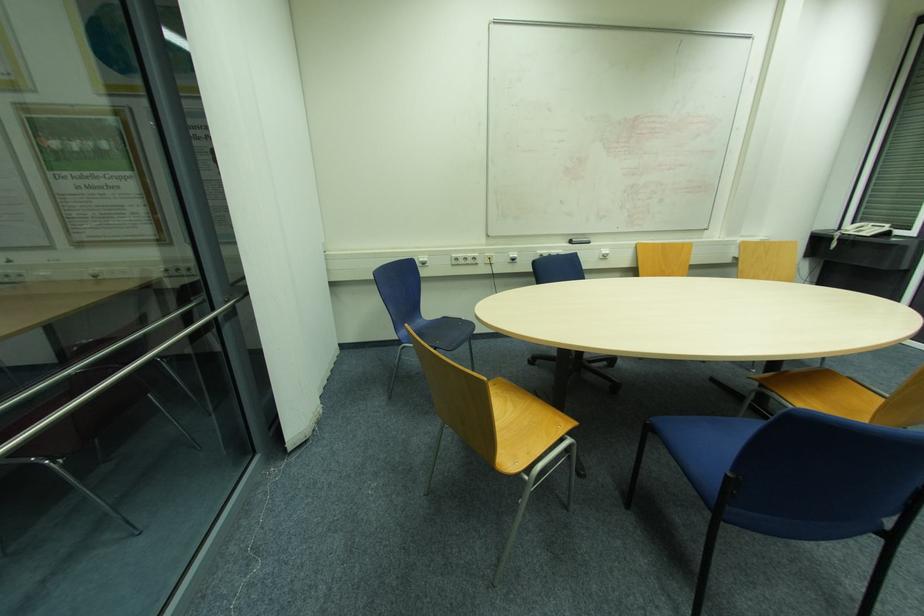
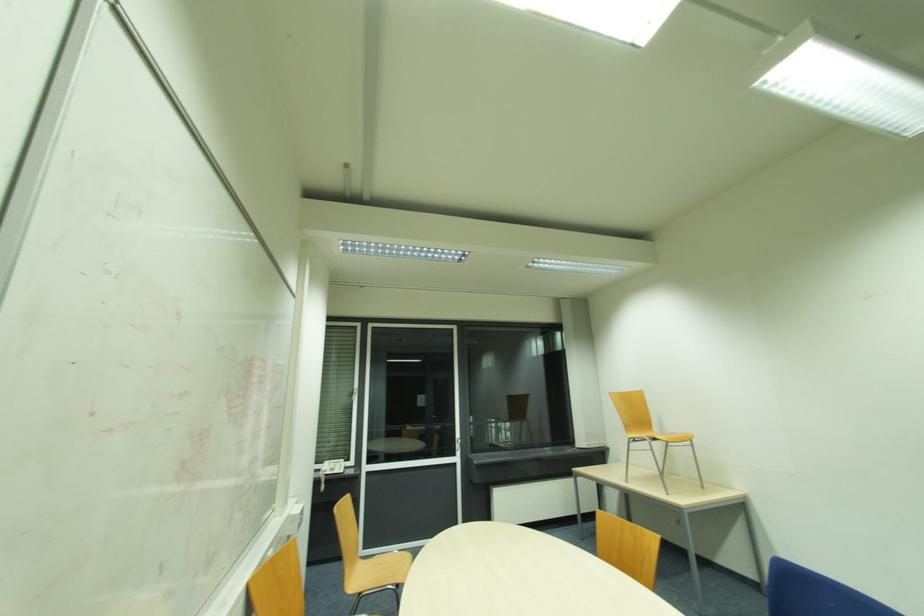
The point at (874, 225) is marked in the first image. Where is the corresponding point in the second image?

(334, 463)